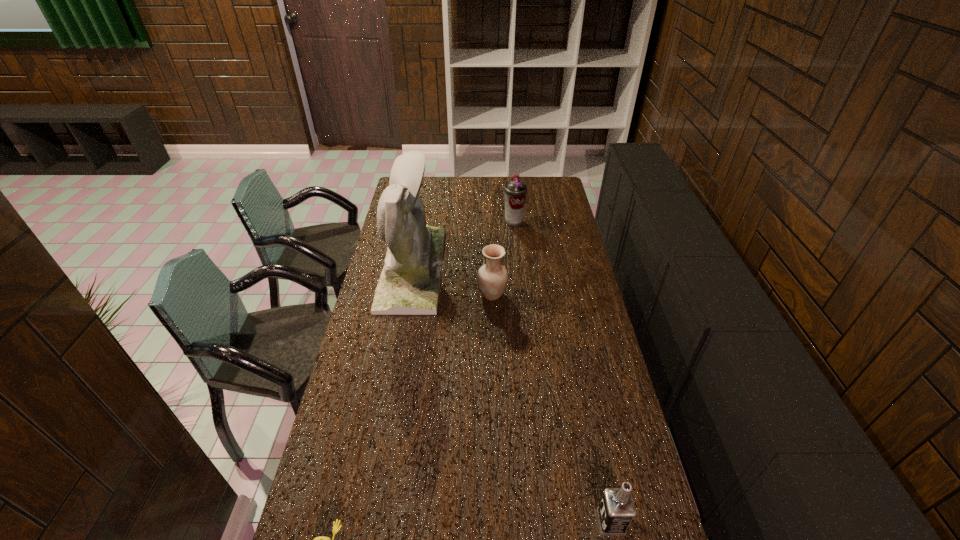
Where is `vacant position located on the front label of the rightmost object`? vacant position located on the front label of the rightmost object is located at coordinates (514, 522).

The image size is (960, 540). What are the coordinates of `object located at the left edge` in the screenshot? It's located at (409, 284).

Image resolution: width=960 pixels, height=540 pixels. I want to click on object located in the right edge section of the desktop, so click(x=616, y=511).

Identify the location of vacant region at the far edge of the desktop. coord(462,190).

Where is `free space at the left edge`? free space at the left edge is located at coordinates (358, 474).

At what (x,y) coordinates should I click in order to perform the action: click on vacant space at the right edge of the desktop. Please return your answer as a coordinate pair (x, y). Looking at the image, I should click on (561, 233).

Identify the location of blank space at the far right corner. The height and width of the screenshot is (540, 960). [560, 183].

Locate an element on the screen. vacant space that's between the sculpture and the farthest object is located at coordinates (463, 245).

Locate an element on the screen. The image size is (960, 540). free space between the rightmost object and the aerosol can is located at coordinates (563, 372).

Identify the location of vacant space in between the aerosol can and the sculpture. Image resolution: width=960 pixels, height=540 pixels. (463, 245).